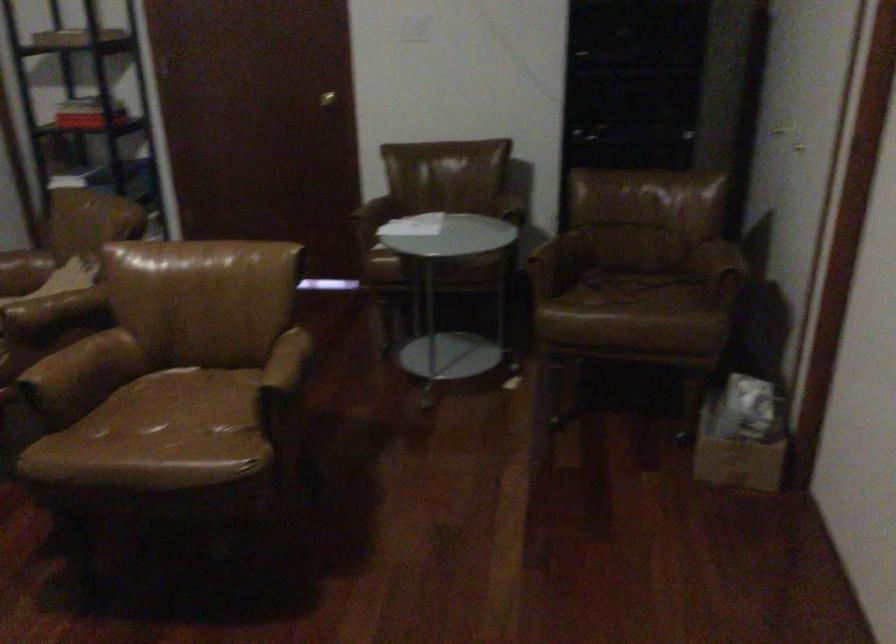
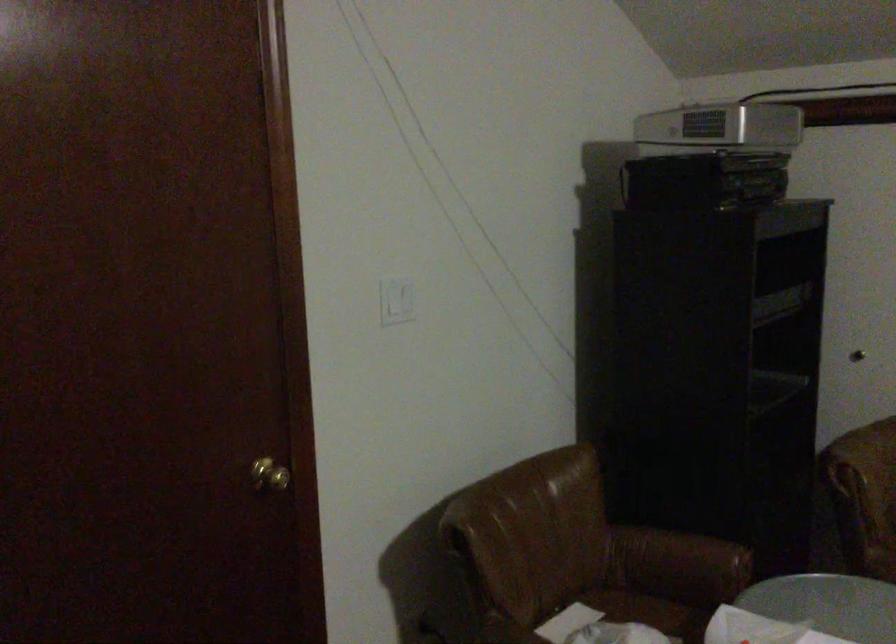
In the second image, find the point that corresponds to (501,207) in the first image.

(679, 559)